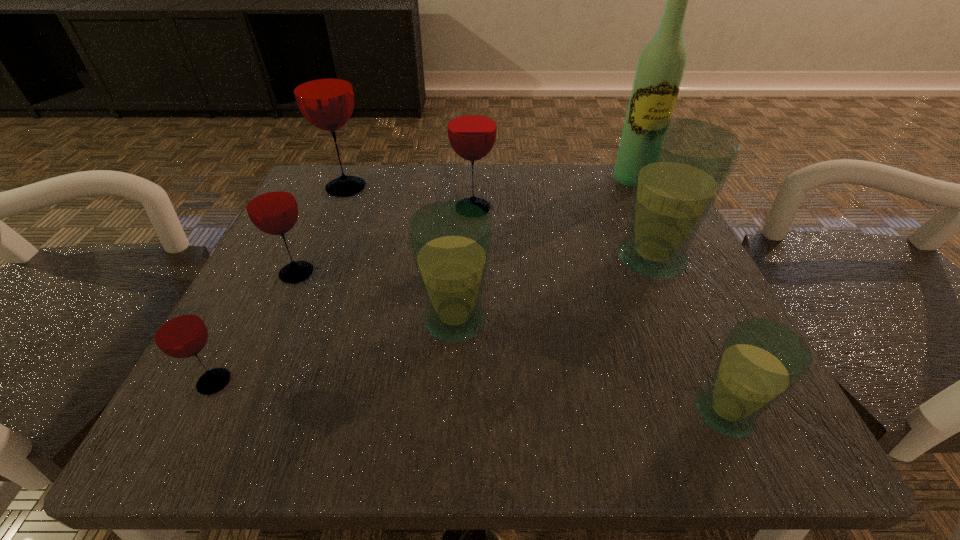
Image resolution: width=960 pixels, height=540 pixels. In order to click on the fifth closest object relative to the smallest red glass in this screenshot , I will do `click(682, 166)`.

Locate which object is the second closest to the biggest red glass. Please provide its 2D coordinates. Your answer should be formatted as a tuple, i.e. [(x, y)], where the tuple contains the x and y coordinates of a point satisfying the conditions above.

[(271, 206)]

Identify which glass is the closest to the smallest blue glass. Please provide its 2D coordinates. Your answer should be formatted as a tuple, i.e. [(x, y)], where the tuple contains the x and y coordinates of a point satisfying the conditions above.

[(682, 166)]

Find the location of `the third closest glass relative to the wine bottle`. the third closest glass relative to the wine bottle is located at coordinates (450, 241).

This screenshot has width=960, height=540. Find the location of `red glass that can be found as the third closest to the third biggest red glass`. red glass that can be found as the third closest to the third biggest red glass is located at coordinates (471, 120).

Where is `red glass that stands as the second closest to the rightmost red glass`? The image size is (960, 540). red glass that stands as the second closest to the rightmost red glass is located at coordinates (271, 206).

Find the location of `blue glass that is the second closest to the smallest red glass`. blue glass that is the second closest to the smallest red glass is located at coordinates (682, 166).

Point out which blue glass is positioned as the second nearest to the white wine bottle. Please provide its 2D coordinates. Your answer should be formatted as a tuple, i.e. [(x, y)], where the tuple contains the x and y coordinates of a point satisfying the conditions above.

[(450, 241)]

At what (x,y) coordinates should I click in order to perform the action: click on free space that satisfies the following two spatial constraints: 1. on the back side of the second nearest red glass; 2. on the right side of the smallest red glass. Please return your answer as a coordinate pair (x, y). Looking at the image, I should click on (270, 274).

Where is `free space that satisfies the following two spatial constraints: 1. on the front side of the biggest red glass; 2. on the right side of the second biggest red glass`? This screenshot has width=960, height=540. free space that satisfies the following two spatial constraints: 1. on the front side of the biggest red glass; 2. on the right side of the second biggest red glass is located at coordinates (338, 209).